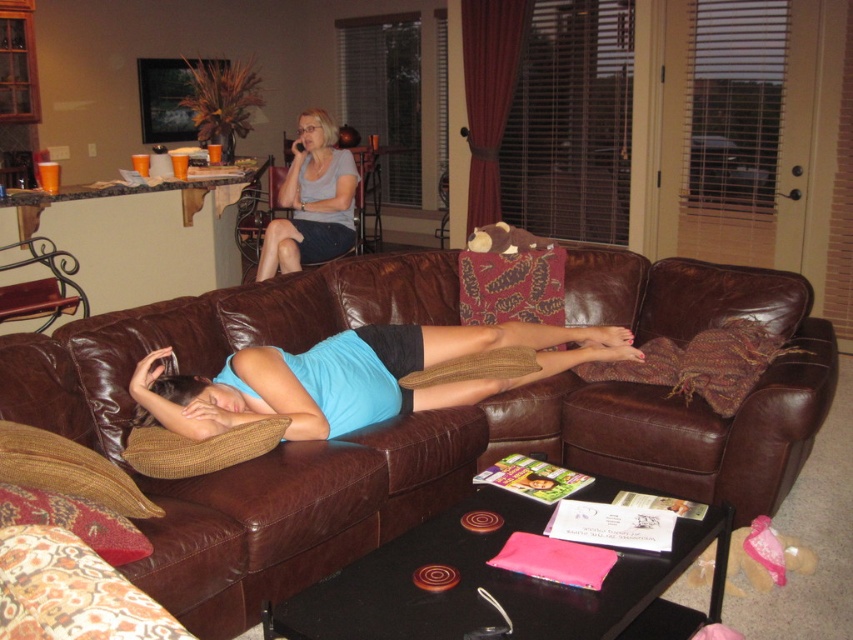
Does matte gray shirt at upper center have a smaller size compared to brown textured pillow at lower left?

Actually, matte gray shirt at upper center might be larger than brown textured pillow at lower left.

Between matte gray shirt at upper center and brown textured pillow at lower left, which one has more height?

matte gray shirt at upper center

Find the location of a particular element. This screenshot has height=640, width=853. matte gray shirt at upper center is located at coordinates (311, 202).

At what (x,y) coordinates should I click in order to perform the action: click on matte gray shirt at upper center. Please return your answer as a coordinate pair (x, y). Image resolution: width=853 pixels, height=640 pixels. Looking at the image, I should click on (311, 202).

From the picture: Does brown textured pillow at lower left appear on the left side of brown woven pillow at center?

Correct, you'll find brown textured pillow at lower left to the left of brown woven pillow at center.

From the picture: Does brown textured pillow at lower left have a greater height compared to brown woven pillow at center?

Yes, brown textured pillow at lower left is taller than brown woven pillow at center.

Describe the element at coordinates (68, 470) in the screenshot. I see `brown textured pillow at lower left` at that location.

What are the coordinates of `brown textured pillow at lower left` in the screenshot? It's located at (68, 470).

Which is more to the right, brown leather couch at center or matte gray shirt at upper center?

brown leather couch at center is more to the right.

From the picture: Does brown leather couch at center appear on the right side of matte gray shirt at upper center?

Correct, you'll find brown leather couch at center to the right of matte gray shirt at upper center.

Does point (225, 515) lie behind point (352, 170)?

No, it is not.

Locate an element on the screen. brown leather couch at center is located at coordinates (502, 448).